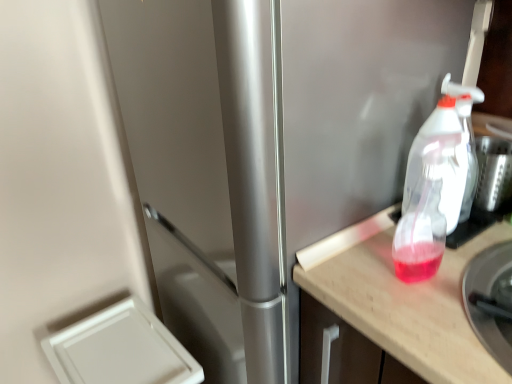
You are a GUI agent. You are given a task and a screenshot of the screen. Output one action in this format:
    pyautogui.click(x=<x>, y=<y>)
    Task: Click on the free space above wooden countertop at right (from a real-world perspective)
    Image resolution: width=512 pixels, height=384 pixels.
    Given the screenshot: What is the action you would take?
    pyautogui.click(x=454, y=260)